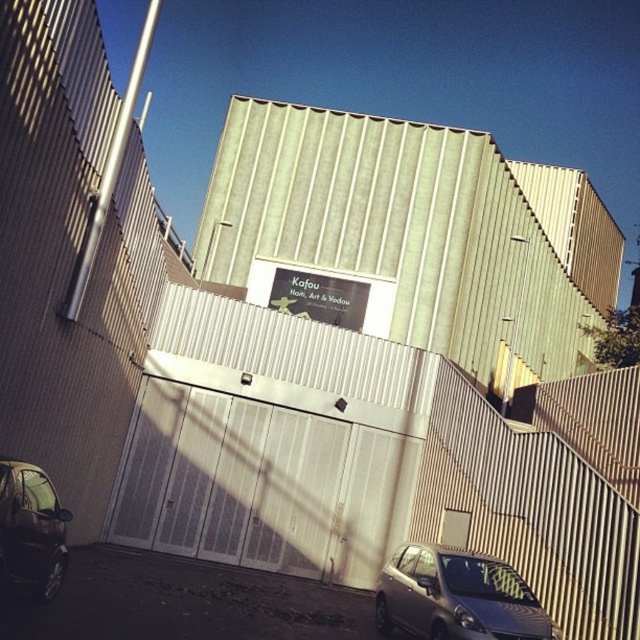
Question: Which point appears farthest from the camera in this image?

Choices:
 (A) (538, 634)
 (B) (8, 568)

Answer: (A)

Question: Does satin silver hatchback at lower right appear over shiny silver car at lower left?

Choices:
 (A) yes
 (B) no

Answer: (B)

Question: Which of the following is the farthest from the observer?

Choices:
 (A) shiny silver car at lower left
 (B) satin silver hatchback at lower right

Answer: (B)

Question: Is satin silver hatchback at lower right closer to the viewer compared to shiny silver car at lower left?

Choices:
 (A) no
 (B) yes

Answer: (A)

Question: Does satin silver hatchback at lower right appear over shiny silver car at lower left?

Choices:
 (A) no
 (B) yes

Answer: (A)

Question: Which point is farther from the camera taking this photo?

Choices:
 (A) (28, 536)
 (B) (474, 605)

Answer: (B)